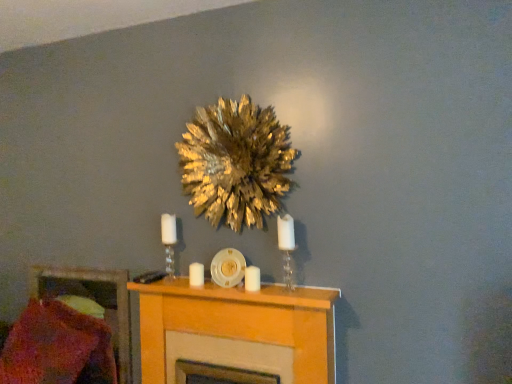
The height and width of the screenshot is (384, 512). Describe the element at coordinates (237, 330) in the screenshot. I see `light wood fireplace at center` at that location.

Identify the location of white matte candle at center, marked as the 2th candle in a left-to-right arrangement. The image size is (512, 384). (252, 279).

Describe the element at coordinates (52, 345) in the screenshot. This screenshot has height=384, width=512. I see `knitted wool pillow at lower left` at that location.

The image size is (512, 384). I want to click on knitted wool pillow at lower left, so click(x=52, y=345).

At what (x,y) coordinates should I click in order to perform the action: click on gold leafy wreath at upper center. Please return your answer as a coordinate pair (x, y). The width and height of the screenshot is (512, 384). Looking at the image, I should click on (236, 163).

Find the location of a particular element. The height and width of the screenshot is (384, 512). light wood fireplace at center is located at coordinates (237, 330).

Does gold leafy wreath at upper center have a smaller size compared to knitted wool pillow at lower left?

Indeed, gold leafy wreath at upper center has a smaller size compared to knitted wool pillow at lower left.

Is gold leafy wreath at upper center turned away from knitted wool pillow at lower left?

No, knitted wool pillow at lower left is not at the back of gold leafy wreath at upper center.

Which is correct: gold leafy wreath at upper center is inside knitted wool pillow at lower left, or outside of it?

gold leafy wreath at upper center is outside knitted wool pillow at lower left.

Is white matte candle at center, arranged as the first candle when viewed from the back, aimed at light wood fireplace at center?

No.

Identify the location of candle lying on the left of light wood fireplace at center. This screenshot has height=384, width=512. [196, 275].

Is white matte candle at center, placed as the 2th candle when sorted from front to back, far from light wood fireplace at center?

white matte candle at center, placed as the 2th candle when sorted from front to back, is near light wood fireplace at center, not far away.

Is point (327, 330) closer to camera compared to point (199, 271)?

That is True.

Is light wood fireplace at center shorter than white matte candle at center, the first candle when ordered from left to right?

No.

Is knitted wool pillow at lower left looking in the opposite direction of white matte candle at center, which is the first candle from right to left?

knitted wool pillow at lower left is not turned away from white matte candle at center, which is the first candle from right to left.

Which is closer to the camera, (23, 357) or (247, 282)?

Point (23, 357).

From the picture: From a real-world perspective, is knitted wool pillow at lower left under white matte candle at center, marked as the 2th candle in a left-to-right arrangement?

Yes, from a real-world perspective, knitted wool pillow at lower left is under white matte candle at center, marked as the 2th candle in a left-to-right arrangement.

In terms of size, does knitted wool pillow at lower left appear bigger or smaller than white matte candle at center, acting as the second candle starting from the back?

Clearly, knitted wool pillow at lower left is larger in size than white matte candle at center, acting as the second candle starting from the back.

From the picture: What's the angular difference between knitted wool pillow at lower left and white matte candle at center, placed as the 2th candle when sorted from front to back,'s facing directions?

The angle between the facing direction of knitted wool pillow at lower left and the facing direction of white matte candle at center, placed as the 2th candle when sorted from front to back, is 0.492 degrees.

Is point (62, 305) closer or farther from the camera than point (197, 272)?

Point (62, 305) appears to be farther away from the viewer than point (197, 272).

Is knitted wool pillow at lower left oriented away from white matte candle at center, acting as the 2th candle starting from the right?

knitted wool pillow at lower left does not have its back to white matte candle at center, acting as the 2th candle starting from the right.

Which object is further away from the camera taking this photo, knitted wool pillow at lower left or white matte candle at center, the first candle when ordered from left to right?

knitted wool pillow at lower left is more distant.

Considering the relative positions of white matte candle at center, placed as the 2th candle when sorted from front to back, and white glass candle holder at center, the 1th candle holder when ordered from back to front, in the image provided, is white matte candle at center, placed as the 2th candle when sorted from front to back, to the left or to the right of white glass candle holder at center, the 1th candle holder when ordered from back to front,?

white matte candle at center, placed as the 2th candle when sorted from front to back, is to the right of white glass candle holder at center, the 1th candle holder when ordered from back to front.

Is white matte candle at center, the first candle when ordered from left to right, bigger than white glass candle holder at center, positioned as the first candle holder in left-to-right order?

No, white matte candle at center, the first candle when ordered from left to right, is not bigger than white glass candle holder at center, positioned as the first candle holder in left-to-right order.

Measure the distance from white matte candle at center, acting as the 2th candle starting from the right, to white glass candle holder at center, the 2th candle holder viewed from the front.

The distance of white matte candle at center, acting as the 2th candle starting from the right, from white glass candle holder at center, the 2th candle holder viewed from the front, is 9.06 inches.

From the image's perspective, is white matte candle at center, placed as the 2th candle when sorted from front to back, below white glass candle holder at center, which ranks as the 2th candle holder in right-to-left order?

Yes.

Measure the distance from knitted wool pillow at lower left to clear glass candle holder at center, the second candle holder positioned from the left.

knitted wool pillow at lower left is 1.35 meters away from clear glass candle holder at center, the second candle holder positioned from the left.

Which is in front, point (58, 323) or point (293, 244)?

The point (293, 244) is closer to the camera.

What's the angular difference between knitted wool pillow at lower left and clear glass candle holder at center, the first candle holder positioned from the right,'s facing directions?

0.541 degrees.

Which is more to the left, knitted wool pillow at lower left or clear glass candle holder at center, the first candle holder positioned from the right?

From the viewer's perspective, knitted wool pillow at lower left appears more on the left side.

In the image, there is a knitted wool pillow at lower left. At what (x,y) coordinates should I click in order to perform the action: click on flower above it (from the image's perspective). Please return your answer as a coordinate pair (x, y). This screenshot has width=512, height=384. Looking at the image, I should click on (236, 163).

From the light wood fireplace at center, count 2nd candles backward and point to it. Please provide its 2D coordinates.

[(196, 275)]

From the picture: Which object lies further to the anchor point knitted wool pillow at lower left, white matte candle at center, acting as the 2th candle starting from the right, or white glass candle holder at center, the 2th candle holder viewed from the front?

The object further to knitted wool pillow at lower left is white matte candle at center, acting as the 2th candle starting from the right.

Estimate the real-world distances between objects in this image. Which object is closer to white glass candle holder at center, which ranks as the 2th candle holder in right-to-left order, white matte candle at center, arranged as the first candle when viewed from the back, or light wood fireplace at center?

white matte candle at center, arranged as the first candle when viewed from the back, lies closer to white glass candle holder at center, which ranks as the 2th candle holder in right-to-left order, than the other object.

Considering their positions, is white glass candle holder at center, the 1th candle holder when ordered from back to front, positioned further to white matte candle at center, the first candle from the front, than white matte candle at center, the first candle when ordered from left to right?

white glass candle holder at center, the 1th candle holder when ordered from back to front, is further to white matte candle at center, the first candle from the front.

Estimate the real-world distances between objects in this image. Which object is closer to white glass candle holder at center, positioned as the first candle holder in left-to-right order, white matte candle at center, the first candle when ordered from left to right, or gold leafy wreath at upper center?

Based on the image, white matte candle at center, the first candle when ordered from left to right, appears to be nearer to white glass candle holder at center, positioned as the first candle holder in left-to-right order.

Estimate the real-world distances between objects in this image. Which object is closer to clear glass candle holder at center, which is the 2th candle holder from back to front, light wood fireplace at center or gold leafy wreath at upper center?

Based on the image, gold leafy wreath at upper center appears to be nearer to clear glass candle holder at center, which is the 2th candle holder from back to front.

Estimate the real-world distances between objects in this image. Which object is further from clear glass candle holder at center, the first candle holder viewed from the front, knitted wool pillow at lower left or white glass candle holder at center, the 1th candle holder when ordered from back to front?

The object further to clear glass candle holder at center, the first candle holder viewed from the front, is knitted wool pillow at lower left.

Estimate the real-world distances between objects in this image. Which object is further from clear glass candle holder at center, the second candle holder positioned from the left, white matte candle at center, placed as the 2th candle when sorted from front to back, or light wood fireplace at center?

white matte candle at center, placed as the 2th candle when sorted from front to back, lies further to clear glass candle holder at center, the second candle holder positioned from the left, than the other object.

When comparing their distances from light wood fireplace at center, does gold leafy wreath at upper center or clear glass candle holder at center, the first candle holder positioned from the right, seem closer?

clear glass candle holder at center, the first candle holder positioned from the right, lies closer to light wood fireplace at center than the other object.

Locate an element on the screen. Image resolution: width=512 pixels, height=384 pixels. candle holder between knitted wool pillow at lower left and gold leafy wreath at upper center from left to right is located at coordinates (169, 242).

The image size is (512, 384). What are the coordinates of `flower located between white glass candle holder at center, positioned as the first candle holder in left-to-right order, and clear glass candle holder at center, the second candle holder positioned from the left, in the left-right direction` in the screenshot? It's located at (236, 163).

At what (x,y) coordinates should I click in order to perform the action: click on candle between gold leafy wreath at upper center and white matte candle at center, arranged as the first candle when viewed from the back, in the up-down direction. Please return your answer as a coordinate pair (x, y). This screenshot has height=384, width=512. Looking at the image, I should click on (252, 279).

You are a GUI agent. You are given a task and a screenshot of the screen. Output one action in this format:
    pyautogui.click(x=<x>, y=<y>)
    Task: Click on the furniture between knitted wool pillow at lower left and clear glass candle holder at center, the second candle holder positioned from the left
    This screenshot has height=384, width=512.
    Given the screenshot: What is the action you would take?
    pyautogui.click(x=237, y=330)